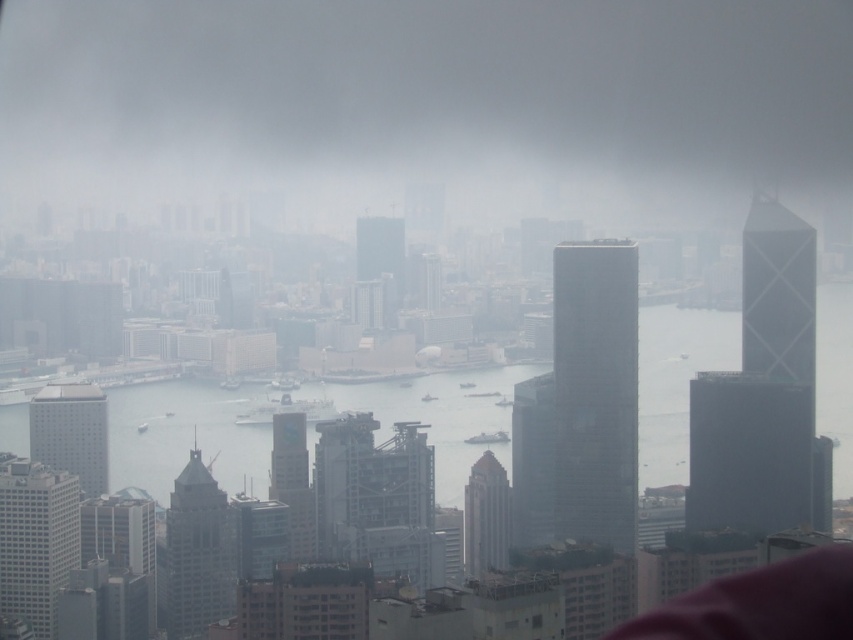
Question: Which point is farther to the camera?

Choices:
 (A) smooth glass skyscraper at right
 (B) glassy reflective skyscraper at center

Answer: (A)

Question: Is gray concrete skyscraper at center-left in front of gray glass skyscraper at center?

Choices:
 (A) no
 (B) yes

Answer: (A)

Question: In this image, where is glassy steel skyscraper at right located relative to gray glass skyscraper at center?

Choices:
 (A) above
 (B) below

Answer: (A)

Question: Among these objects, which one is nearest to the camera?

Choices:
 (A) clear water at center
 (B) gray glass skyscraper at center
 (C) smooth glass skyscraper at center

Answer: (A)

Question: Is gray fog at center closer to the viewer compared to white matte building at lower left?

Choices:
 (A) yes
 (B) no

Answer: (A)

Question: Which of the following is the closest to the observer?

Choices:
 (A) (222, 596)
 (B) (799, 435)
 (C) (479, 536)
 (D) (521, 376)

Answer: (D)